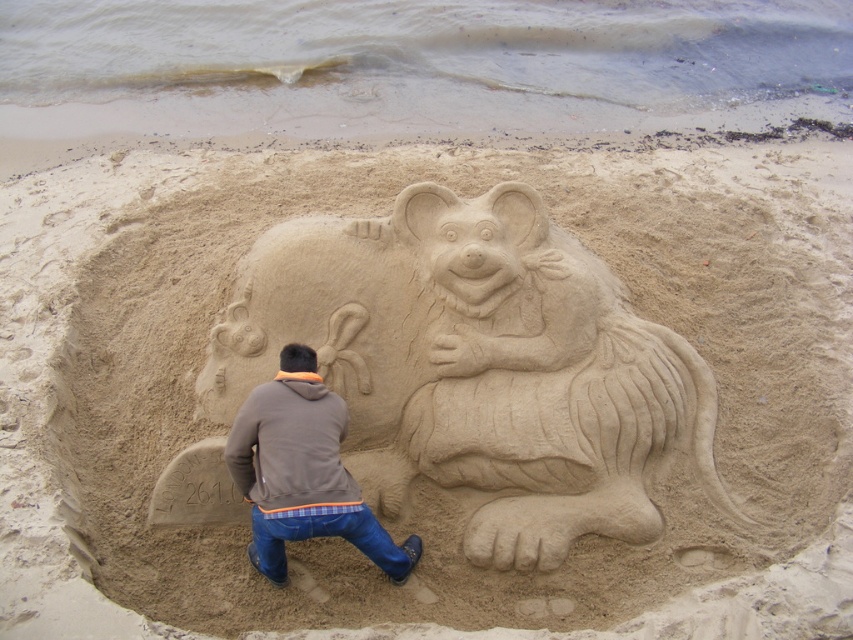
Question: Which point is farther to the camera?

Choices:
 (A) brown cotton hoodie at center
 (B) smooth sand bear at center
 (C) brown fleece jacket at lower center

Answer: (B)

Question: Does smooth sand bear at center have a greater width compared to brown fleece jacket at lower center?

Choices:
 (A) yes
 (B) no

Answer: (A)

Question: Does brown cotton hoodie at center lie behind brown fleece jacket at lower center?

Choices:
 (A) yes
 (B) no

Answer: (A)

Question: Which point appears closest to the camera in this image?

Choices:
 (A) (305, 458)
 (B) (625, 460)

Answer: (A)

Question: Considering the real-world distances, which object is closest to the smooth sand bear at center?

Choices:
 (A) brown cotton hoodie at center
 (B) brown fleece jacket at lower center

Answer: (A)

Question: Is brown cotton hoodie at center bigger than brown fleece jacket at lower center?

Choices:
 (A) yes
 (B) no

Answer: (A)